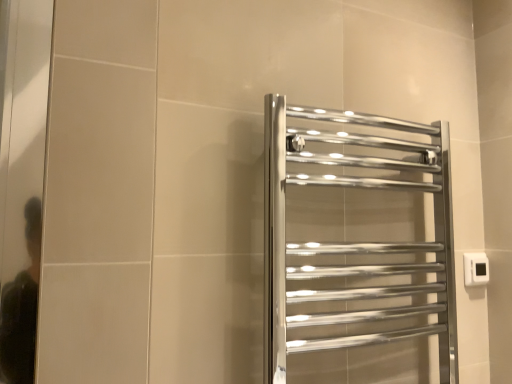
Question: Is polished chrome towel rack at center located within white plastic electric outlet at right?

Choices:
 (A) no
 (B) yes

Answer: (A)

Question: Could you tell me if white plastic electric outlet at right is turned towards polished chrome towel rack at center?

Choices:
 (A) yes
 (B) no

Answer: (B)

Question: Is the position of white plastic electric outlet at right less distant than that of polished chrome towel rack at center?

Choices:
 (A) no
 (B) yes

Answer: (A)

Question: From a real-world perspective, is white plastic electric outlet at right physically below polished chrome towel rack at center?

Choices:
 (A) yes
 (B) no

Answer: (A)

Question: Is white plastic electric outlet at right positioned beyond the bounds of polished chrome towel rack at center?

Choices:
 (A) yes
 (B) no

Answer: (A)

Question: Can you confirm if white plastic electric outlet at right is shorter than polished chrome towel rack at center?

Choices:
 (A) yes
 (B) no

Answer: (A)

Question: Considering the relative sizes of polished chrome towel rack at center and white plastic electric outlet at right in the image provided, is polished chrome towel rack at center wider than white plastic electric outlet at right?

Choices:
 (A) no
 (B) yes

Answer: (B)

Question: Considering the relative sizes of polished chrome towel rack at center and white plastic electric outlet at right in the image provided, is polished chrome towel rack at center thinner than white plastic electric outlet at right?

Choices:
 (A) no
 (B) yes

Answer: (A)

Question: From the image's perspective, is polished chrome towel rack at center beneath white plastic electric outlet at right?

Choices:
 (A) yes
 (B) no

Answer: (B)

Question: Is polished chrome towel rack at center further to the viewer compared to white plastic electric outlet at right?

Choices:
 (A) no
 (B) yes

Answer: (A)

Question: Can you confirm if polished chrome towel rack at center is positioned to the right of white plastic electric outlet at right?

Choices:
 (A) yes
 (B) no

Answer: (B)

Question: Is polished chrome towel rack at center looking in the opposite direction of white plastic electric outlet at right?

Choices:
 (A) no
 (B) yes

Answer: (A)

Question: From their relative heights in the image, would you say white plastic electric outlet at right is taller or shorter than polished chrome towel rack at center?

Choices:
 (A) short
 (B) tall

Answer: (A)